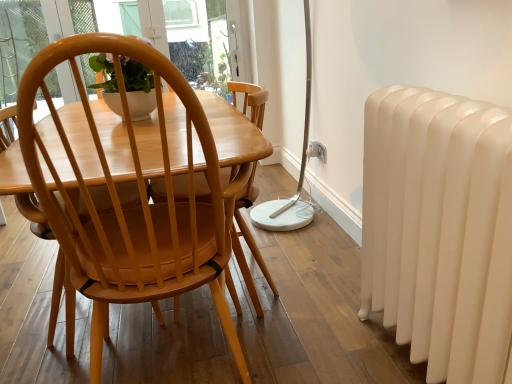
Question: Considering the relative sizes of white plastic power outlet at lower center and white plastic electric outlet at center in the image provided, is white plastic power outlet at lower center smaller than white plastic electric outlet at center?

Choices:
 (A) yes
 (B) no

Answer: (A)

Question: From the image's perspective, is white plastic power outlet at lower center below white plastic electric outlet at center?

Choices:
 (A) yes
 (B) no

Answer: (A)

Question: Is white plastic power outlet at lower center oriented towards white plastic electric outlet at center?

Choices:
 (A) yes
 (B) no

Answer: (A)

Question: Is white plastic power outlet at lower center thinner than white plastic electric outlet at center?

Choices:
 (A) no
 (B) yes

Answer: (B)

Question: Does white plastic power outlet at lower center appear on the right side of white plastic electric outlet at center?

Choices:
 (A) yes
 (B) no

Answer: (A)

Question: Considering the relative positions of white plastic power outlet at lower center and white plastic electric outlet at center in the image provided, is white plastic power outlet at lower center to the left of white plastic electric outlet at center from the viewer's perspective?

Choices:
 (A) yes
 (B) no

Answer: (B)

Question: Does white plastic electric outlet at center have a greater height compared to white plastic power outlet at lower center?

Choices:
 (A) yes
 (B) no

Answer: (A)

Question: Can you confirm if white plastic electric outlet at center is positioned to the left of white plastic power outlet at lower center?

Choices:
 (A) yes
 (B) no

Answer: (A)

Question: Is white plastic electric outlet at center to the right of white plastic power outlet at lower center from the viewer's perspective?

Choices:
 (A) yes
 (B) no

Answer: (B)

Question: Can you see white plastic electric outlet at center touching white plastic power outlet at lower center?

Choices:
 (A) no
 (B) yes

Answer: (B)

Question: Does white plastic electric outlet at center come behind white plastic power outlet at lower center?

Choices:
 (A) no
 (B) yes

Answer: (B)

Question: From a real-world perspective, is white plastic electric outlet at center positioned under white plastic power outlet at lower center based on gravity?

Choices:
 (A) no
 (B) yes

Answer: (A)

Question: Considering the relative sizes of matte wood chair at center and white glossy radiator at right in the image provided, is matte wood chair at center shorter than white glossy radiator at right?

Choices:
 (A) yes
 (B) no

Answer: (B)